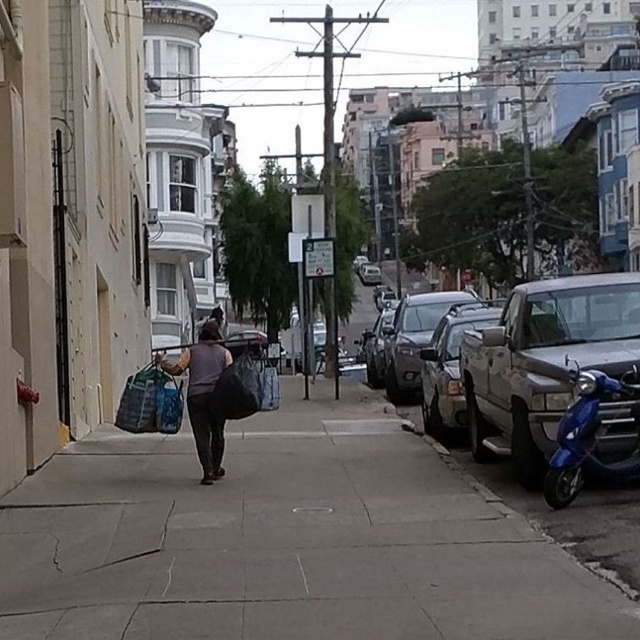
You are a delivery person who needs to park your blue glossy scooter at lower right near the sidewalk. The parking zone is marked at coordinates between 0.6 and 0.7 on the x and y axes. Is your scooter within the parking zone?

The blue glossy scooter at lower right is located at point [589,435]. Since both coordinates fall within the range of 0.6 to 0.7 on the x and y axes, the scooter is within the parking zone.

You are a delivery person who needs to park your scooter and truck on the sidewalk. The blue glossy scooter at lower right must be parked to the left of the silver metallic truck at center. Is this possible given their current positions?

The blue glossy scooter at lower right is currently to the right of the silver metallic truck at center, so to park the blue glossy scooter at lower right to the left of the silver metallic truck at center, you would need to move them, as their current positions do not meet the requirement.

You are a delivery person who needs to park your blue glossy scooter at lower right near the dark brown fabric bag at center. Can you park it to the right of the bag without moving the bag?

The blue glossy scooter at lower right is already positioned on the right side of the dark brown fabric bag at center, so you can park it there without moving the bag.